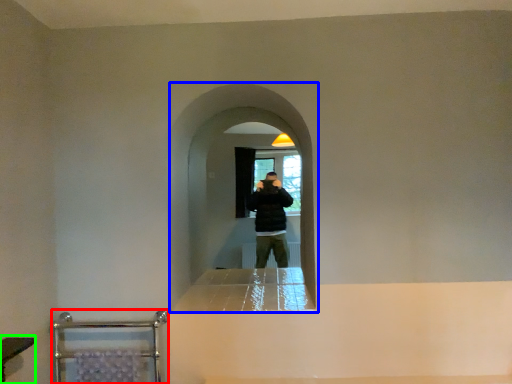
Question: Based on their relative distances, which object is nearer to balustrade (highlighted by a red box)? Choose from screen door (highlighted by a blue box) and vanity (highlighted by a green box).

Choices:
 (A) screen door
 (B) vanity

Answer: (B)